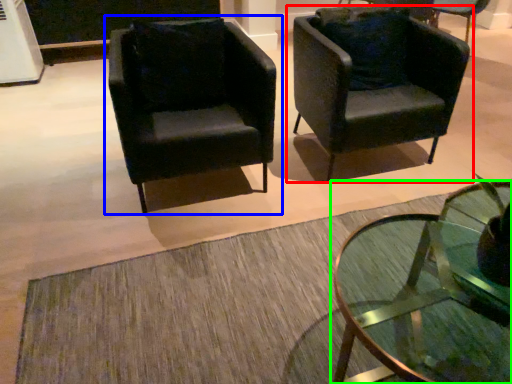
Question: Based on their relative distances, which object is nearer to chair (highlighted by a red box)? Choose from chair (highlighted by a blue box) and coffee table (highlighted by a green box).

Choices:
 (A) chair
 (B) coffee table

Answer: (A)